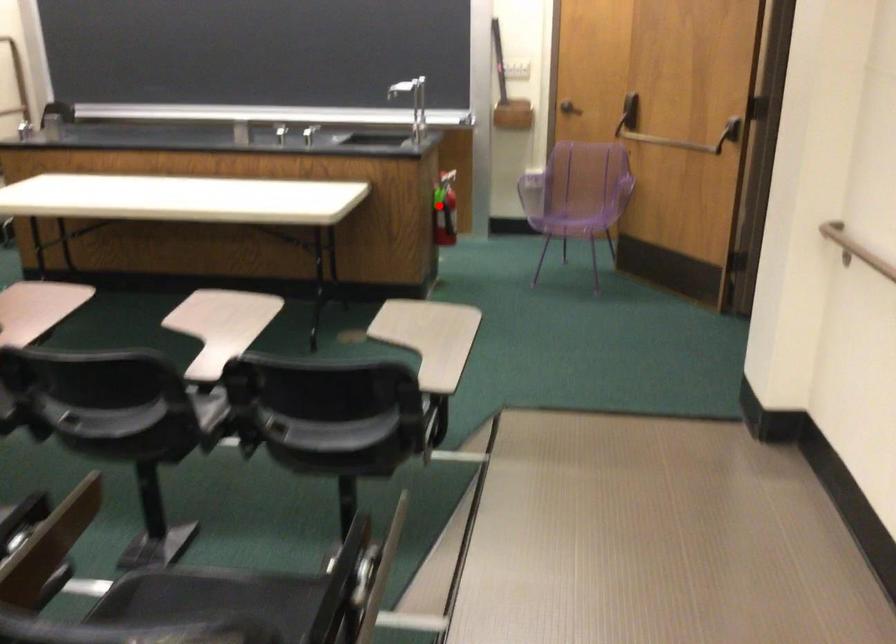
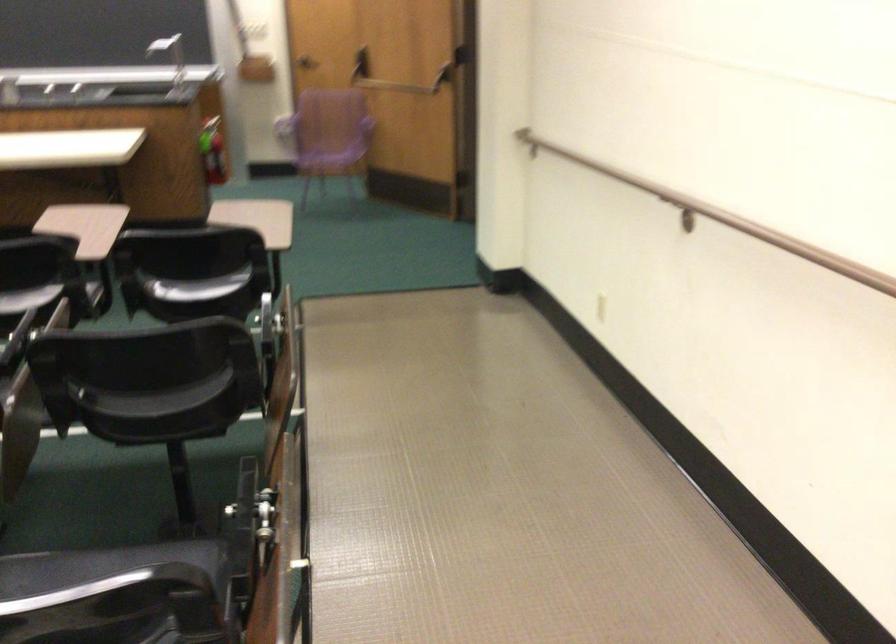
Where in the second image is the point corresponding to the highlighted location from the first image?

(212, 151)